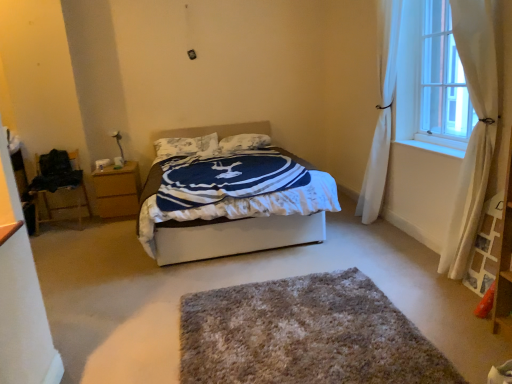
Question: Can you confirm if textured white pillow at center, which is the first pillow in left-to-right order, is smaller than white sheer curtain at right, the first curtain positioned from the front?

Choices:
 (A) yes
 (B) no

Answer: (A)

Question: Can you confirm if textured white pillow at center, marked as the 2th pillow in a right-to-left arrangement, is bigger than white sheer curtain at right, which is the second curtain in back-to-front order?

Choices:
 (A) no
 (B) yes

Answer: (A)

Question: Is white sheer curtain at right, the first curtain positioned from the front, surrounded by textured white pillow at center, marked as the 2th pillow in a right-to-left arrangement?

Choices:
 (A) yes
 (B) no

Answer: (B)

Question: Is textured white pillow at center, marked as the 2th pillow in a right-to-left arrangement, not inside white sheer curtain at right, which is the second curtain in back-to-front order?

Choices:
 (A) no
 (B) yes

Answer: (B)

Question: Is textured white pillow at center, marked as the 2th pillow in a right-to-left arrangement, placed right next to white sheer curtain at right, the first curtain positioned from the front?

Choices:
 (A) no
 (B) yes

Answer: (A)

Question: Can you confirm if textured white pillow at center, which is the first pillow in left-to-right order, is thinner than white sheer curtain at right, the first curtain positioned from the front?

Choices:
 (A) yes
 (B) no

Answer: (B)

Question: Is wooden nightstand at left positioned beyond the bounds of white sheer curtain at upper right?

Choices:
 (A) no
 (B) yes

Answer: (B)

Question: Would you say wooden nightstand at left is a long distance from white sheer curtain at upper right?

Choices:
 (A) no
 (B) yes

Answer: (B)

Question: Considering the relative positions of wooden nightstand at left and white sheer curtain at upper right in the image provided, is wooden nightstand at left in front of white sheer curtain at upper right?

Choices:
 (A) no
 (B) yes

Answer: (A)

Question: From a real-world perspective, is wooden nightstand at left positioned under white sheer curtain at upper right based on gravity?

Choices:
 (A) no
 (B) yes

Answer: (B)

Question: Is wooden nightstand at left positioned with its back to white sheer curtain at upper right?

Choices:
 (A) yes
 (B) no

Answer: (B)

Question: Is white sheer curtain at upper right inside wooden nightstand at left?

Choices:
 (A) yes
 (B) no

Answer: (B)

Question: Does white sheer curtain at upper right turn towards white soft pillow at center, marked as the 2th pillow in a left-to-right arrangement?

Choices:
 (A) no
 (B) yes

Answer: (A)